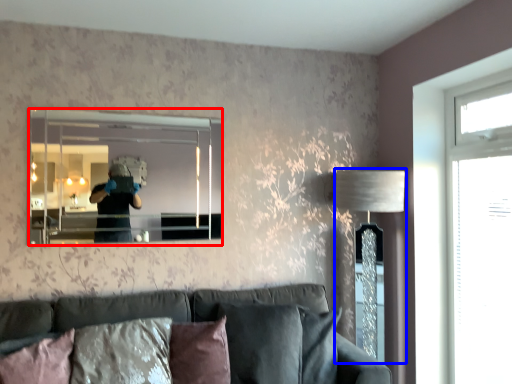
Question: Which object appears closest to the camera in this image, mirror (highlighted by a red box) or table lamp (highlighted by a blue box)?

Choices:
 (A) mirror
 (B) table lamp

Answer: (A)